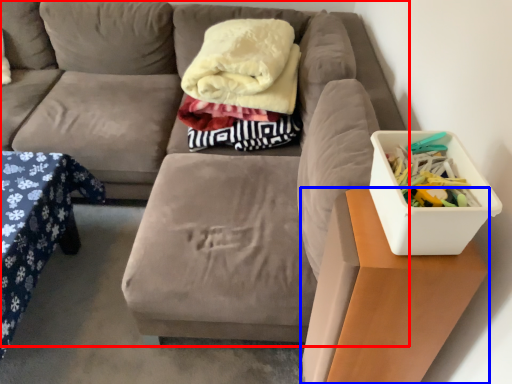
Question: Which point is further to the camera, studio couch (highlighted by a red box) or table (highlighted by a blue box)?

Choices:
 (A) studio couch
 (B) table

Answer: (A)